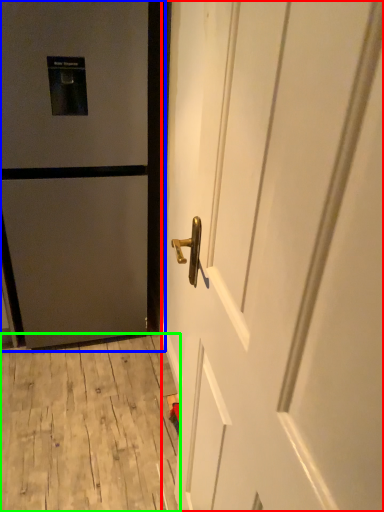
Question: Considering the real-world distances, which object is closest to door (highlighted by a red box)? door (highlighted by a blue box) or plywood (highlighted by a green box).

Choices:
 (A) door
 (B) plywood

Answer: (A)